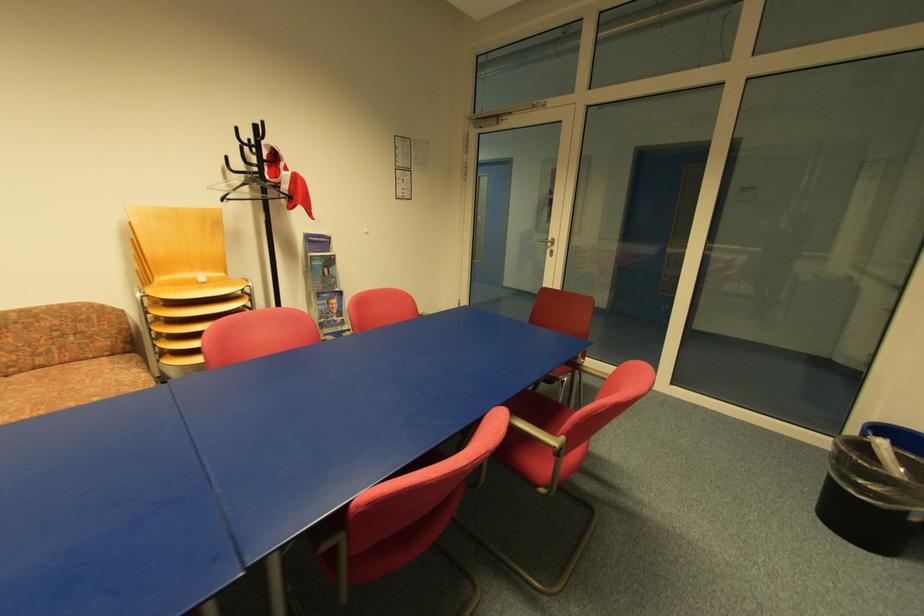
Locate an element on the screen. metal door handle is located at coordinates (546, 241).